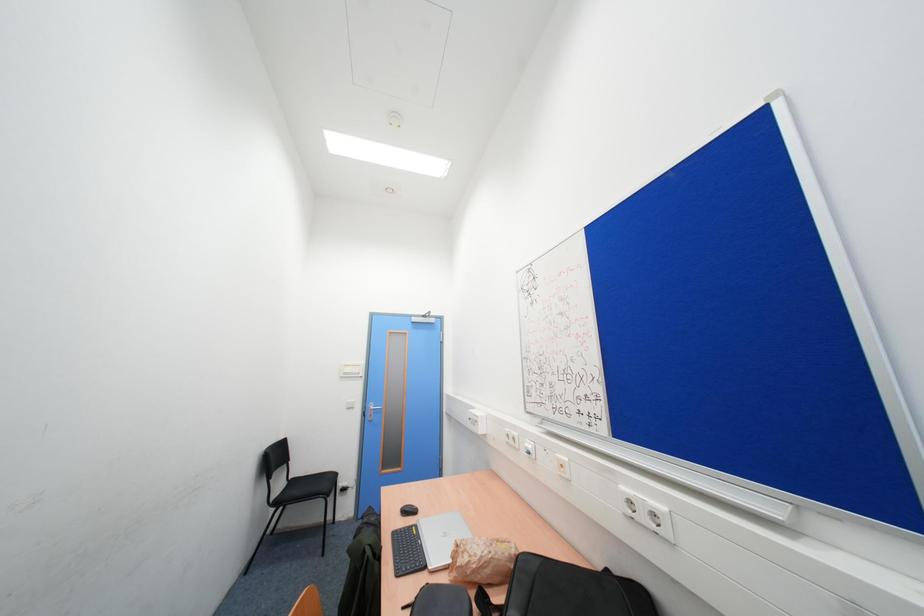
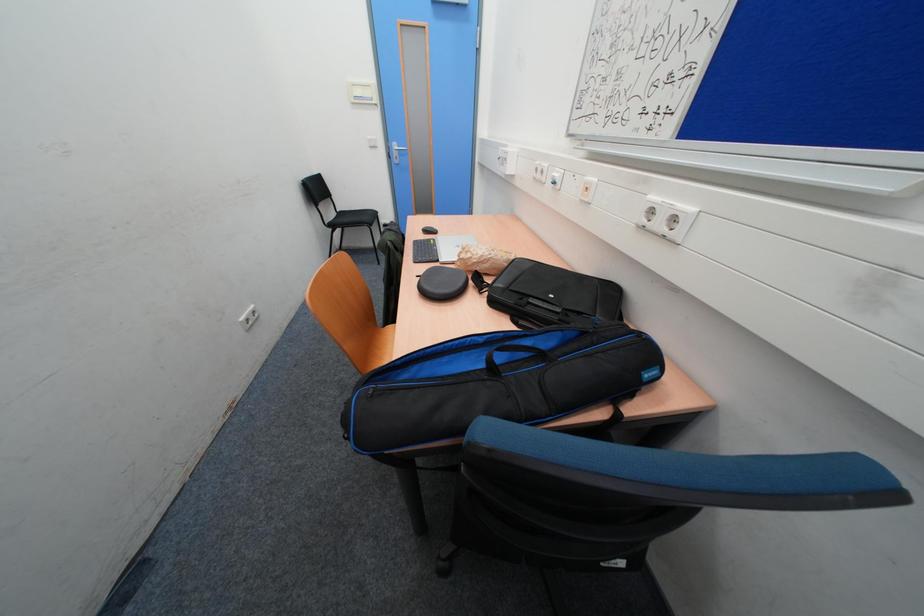
Question: The first image is from the beginning of the video and the second image is from the end. How did the camera likely rotate when shooting the video?

Choices:
 (A) Left
 (B) Right
 (C) Up
 (D) Down

Answer: (D)